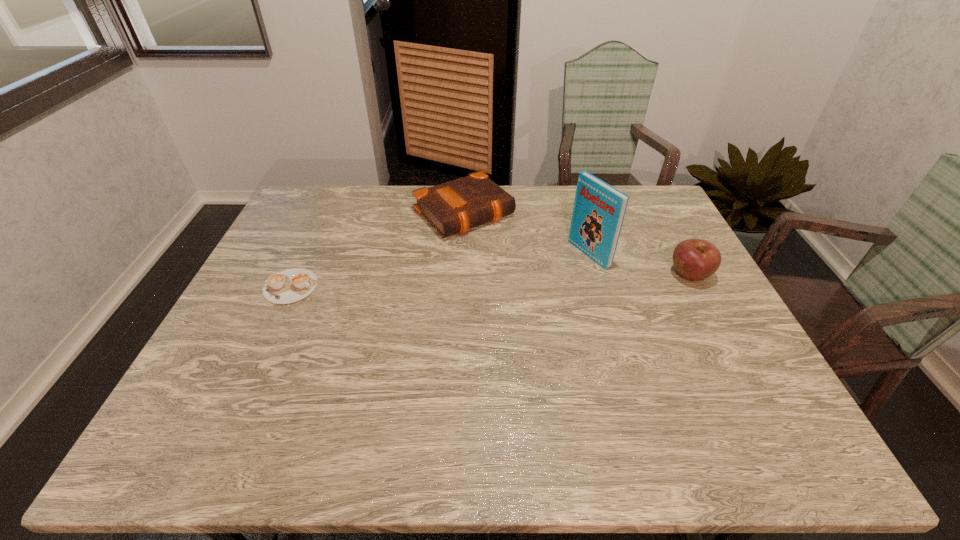
Image resolution: width=960 pixels, height=540 pixels. Identify the location of object that is at the right edge. (694, 259).

Identify the location of vacant region at the far edge of the desktop. (525, 206).

The image size is (960, 540). In order to click on free space at the left edge of the desktop in this screenshot , I will do `click(275, 239)`.

Where is `free space at the right edge of the desktop`? free space at the right edge of the desktop is located at coordinates (671, 246).

Where is `vacant space at the near left corner`? vacant space at the near left corner is located at coordinates (233, 399).

This screenshot has height=540, width=960. In order to click on free location at the far right corner in this screenshot , I will do `click(641, 220)`.

I want to click on vacant area that lies between the third object from right to left and the shortest object, so (x=377, y=250).

Where is `free area in between the second tallest object and the leftmost object`? The height and width of the screenshot is (540, 960). free area in between the second tallest object and the leftmost object is located at coordinates (491, 281).

You are a GUI agent. You are given a task and a screenshot of the screen. Output one action in this format:
    pyautogui.click(x=<x>, y=<y>)
    Task: Click on the vacant area that lies between the tallest object and the rightmost object
    Image resolution: width=960 pixels, height=540 pixels.
    Given the screenshot: What is the action you would take?
    [639, 265]

Where is `vacant area between the book and the rightmost object`? This screenshot has width=960, height=540. vacant area between the book and the rightmost object is located at coordinates (639, 265).